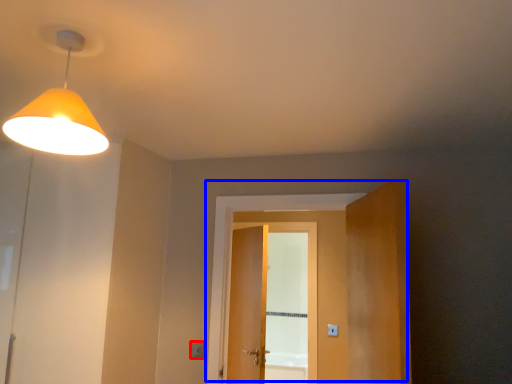
Question: Which point is further to the camera, light switch (highlighted by a red box) or door (highlighted by a blue box)?

Choices:
 (A) light switch
 (B) door

Answer: (A)